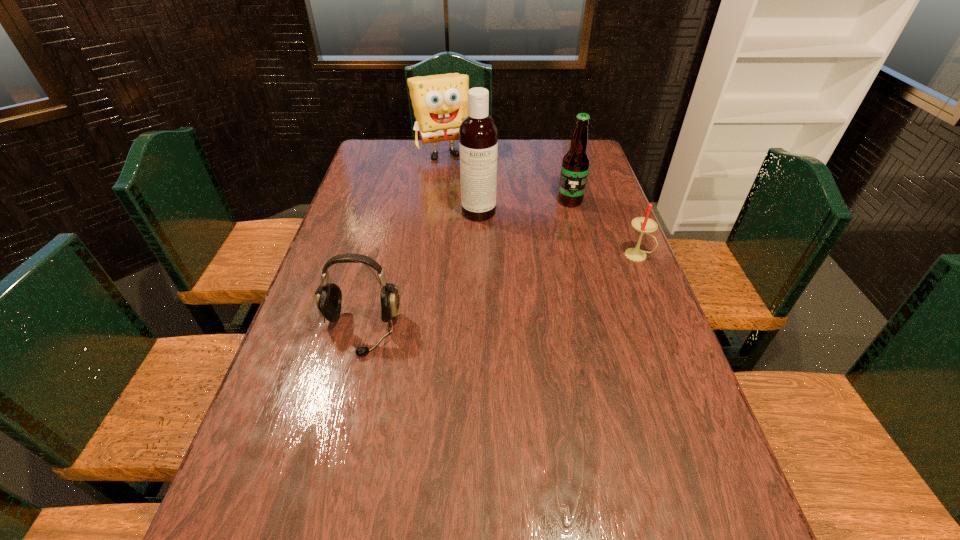
Find the location of a particular element. free space on the desktop that is between the nearest object and the rightmost object and is positioned on the face of the farthest object is located at coordinates (521, 287).

Where is `vacant spot on the desktop that is between the nearest object and the rightmost object and is positioned on the label of the fourth object from left to right`? This screenshot has height=540, width=960. vacant spot on the desktop that is between the nearest object and the rightmost object and is positioned on the label of the fourth object from left to right is located at coordinates (539, 282).

The width and height of the screenshot is (960, 540). Find the location of `vacant space on the desktop that is between the headset and the candle and is positioned on the label side of the tallest object`. vacant space on the desktop that is between the headset and the candle and is positioned on the label side of the tallest object is located at coordinates (497, 293).